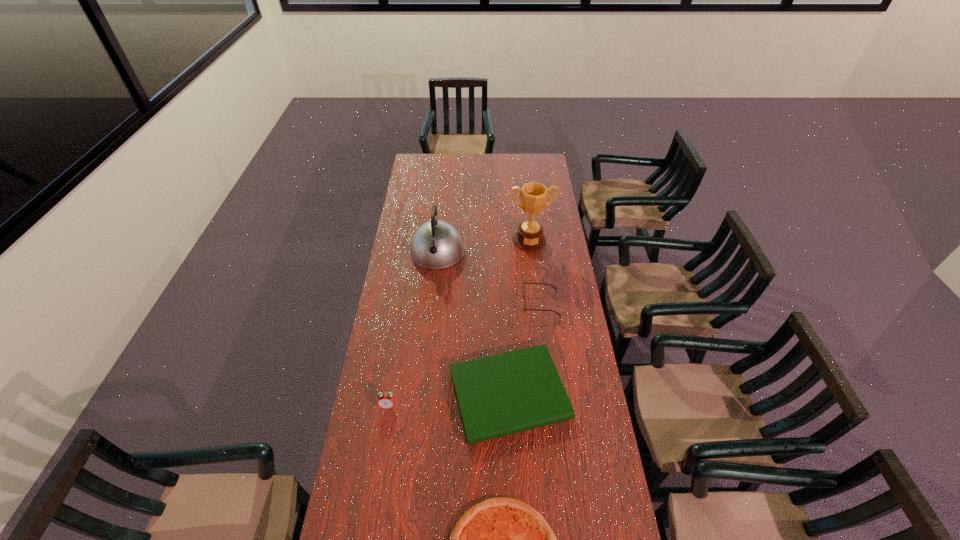
Identify the location of the second closest object relative to the nearest object. This screenshot has width=960, height=540. (386, 400).

Where is `free space that satisfies the following two spatial constraints: 1. from the spout of the second shortest object; 2. on the left side of the kettle`? The width and height of the screenshot is (960, 540). free space that satisfies the following two spatial constraints: 1. from the spout of the second shortest object; 2. on the left side of the kettle is located at coordinates (422, 395).

I want to click on blank space that satisfies the following two spatial constraints: 1. from the spout of the fifth tallest object; 2. on the right side of the kettle, so click(x=422, y=395).